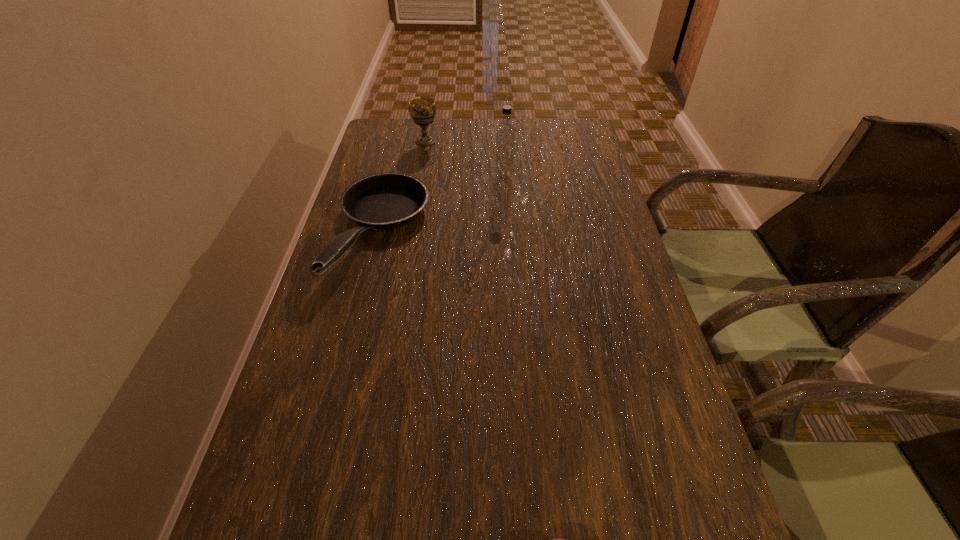
Image resolution: width=960 pixels, height=540 pixels. In order to click on the tallest object in this screenshot , I will do `click(505, 135)`.

Where is `water bottle`? This screenshot has width=960, height=540. water bottle is located at coordinates click(x=505, y=135).

Where is `the third shortest object`? The image size is (960, 540). the third shortest object is located at coordinates (422, 110).

Find the location of a particular element. The width and height of the screenshot is (960, 540). chalice is located at coordinates (422, 110).

Where is `frying pan`? This screenshot has width=960, height=540. frying pan is located at coordinates (383, 201).

Locate an element on the screen. the second nearest object is located at coordinates (383, 201).

The width and height of the screenshot is (960, 540). I want to click on vacant space located 0.250m on the back of the water bottle, so click(501, 132).

Image resolution: width=960 pixels, height=540 pixels. Identify the location of vacant space situated on the back of the chalice. (428, 125).

This screenshot has height=540, width=960. I want to click on free space located 0.260m on the back of the frying pan, so click(x=403, y=140).

I want to click on object that is at the far edge, so click(x=422, y=110).